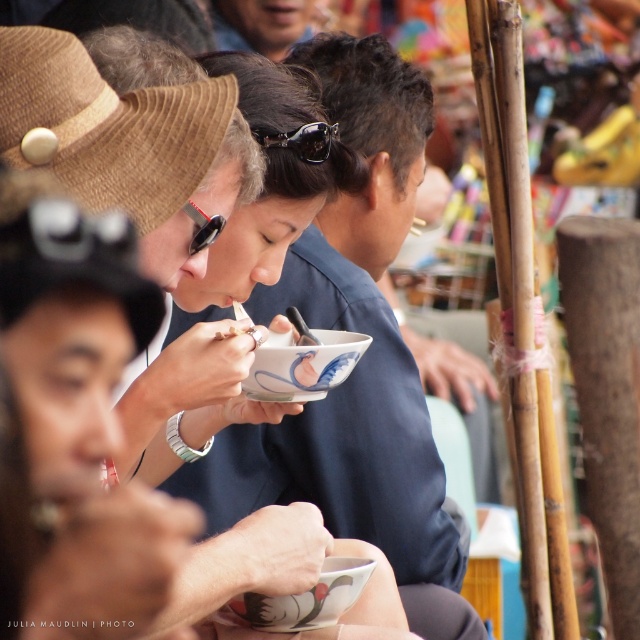
You are organizing a safety gear display at the market. You have two pairs of black rubber goggles at center and black rubber goggles at upper center. Which pair should you choose if you need the wider one for demonstration?

The black rubber goggles at center should be chosen because its width is larger than the black rubber goggles at upper center.

You are a photographer at the market event. You want to take a photo of the black rubber goggles at upper center without the brown corduroy hat at upper left appearing in the frame. Is it possible to do so by moving the camera slightly downward?

The brown corduroy hat at upper left is located above the black rubber goggles at upper center. Moving the camera slightly downward would position the frame below the hat, so yes, it is possible to capture the black rubber goggles at upper center without the brown corduroy hat at upper left in the frame.

You are a photographer at the market event. You want to capture a photo that includes both the brown corduroy hat at upper left and the black rubber goggles at upper center. What is the minimum distance you need to maintain between these two objects in your frame?

The minimum distance between the brown corduroy hat at upper left and the black rubber goggles at upper center should be 19.40 inches to ensure both are clearly visible in the photo.